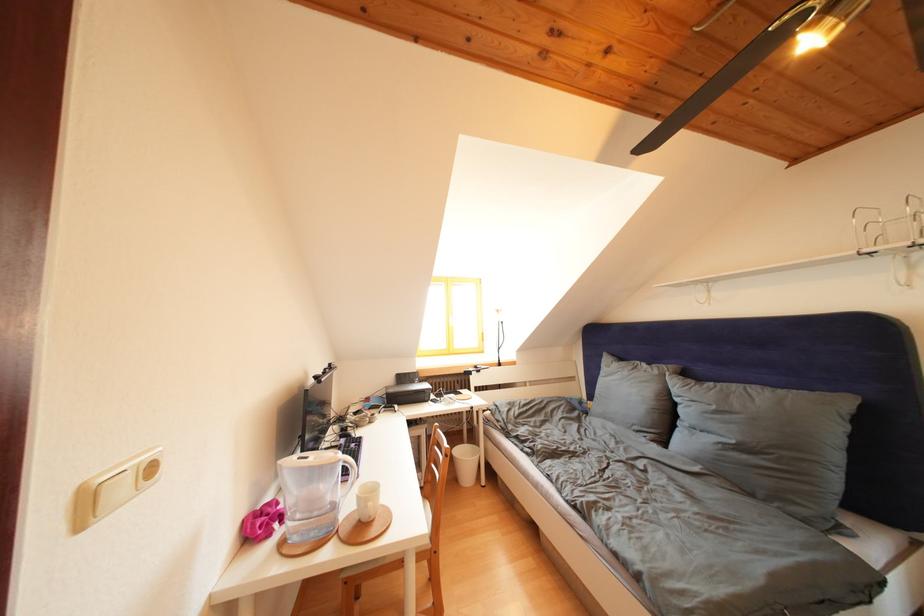
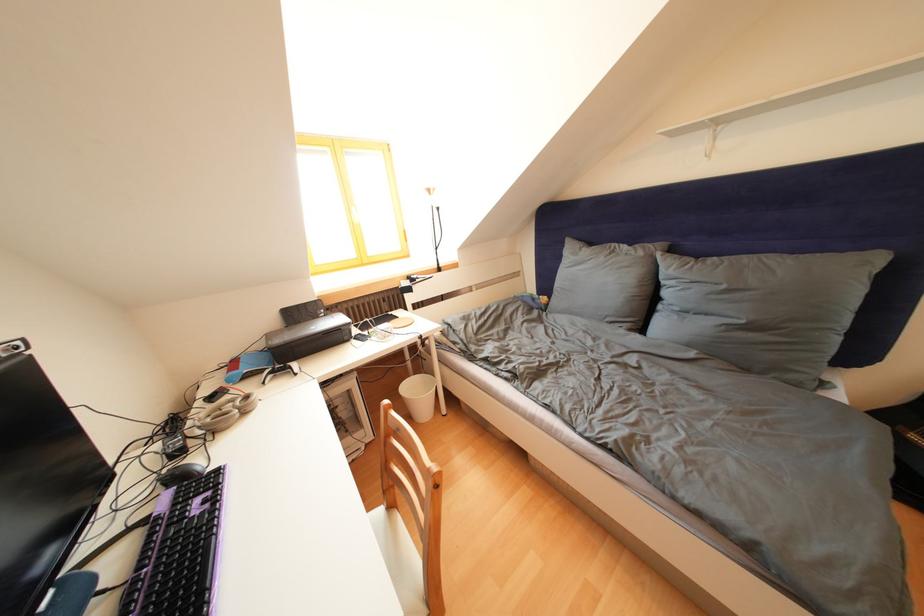
Locate, in the second image, the point that corresponds to [663,377] in the first image.

(649, 259)